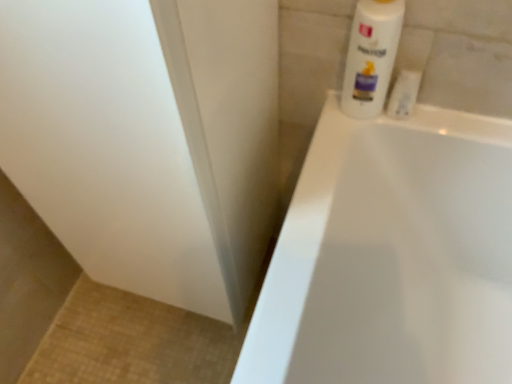
Question: Could you tell me if white plastic tube at upper right is facing white glossy lotion at upper right?

Choices:
 (A) yes
 (B) no

Answer: (B)

Question: Considering the relative sizes of white plastic tube at upper right and white glossy lotion at upper right in the image provided, is white plastic tube at upper right smaller than white glossy lotion at upper right?

Choices:
 (A) no
 (B) yes

Answer: (B)

Question: Is white glossy lotion at upper right located within white plastic tube at upper right?

Choices:
 (A) yes
 (B) no

Answer: (B)

Question: Considering the relative positions of white plastic tube at upper right and white glossy lotion at upper right in the image provided, is white plastic tube at upper right to the left of white glossy lotion at upper right from the viewer's perspective?

Choices:
 (A) no
 (B) yes

Answer: (A)

Question: Can you confirm if white plastic tube at upper right is thinner than white glossy lotion at upper right?

Choices:
 (A) no
 (B) yes

Answer: (B)

Question: From the image's perspective, is white plastic tube at upper right below white glossy lotion at upper right?

Choices:
 (A) yes
 (B) no

Answer: (A)

Question: From the image's perspective, is white glossy lotion at upper right beneath white plastic tube at upper right?

Choices:
 (A) yes
 (B) no

Answer: (B)

Question: Is white glossy lotion at upper right oriented away from white plastic tube at upper right?

Choices:
 (A) no
 (B) yes

Answer: (A)

Question: Does white glossy lotion at upper right have a lesser width compared to white plastic tube at upper right?

Choices:
 (A) yes
 (B) no

Answer: (B)

Question: Is white glossy lotion at upper right wider than white plastic tube at upper right?

Choices:
 (A) no
 (B) yes

Answer: (B)

Question: Is white glossy lotion at upper right further to camera compared to white plastic tube at upper right?

Choices:
 (A) yes
 (B) no

Answer: (B)

Question: From a real-world perspective, is white glossy lotion at upper right positioned under white plastic tube at upper right based on gravity?

Choices:
 (A) no
 (B) yes

Answer: (A)

Question: Would you say white plastic tube at upper right is to the left or to the right of white glossy lotion at upper right in the picture?

Choices:
 (A) right
 (B) left

Answer: (A)